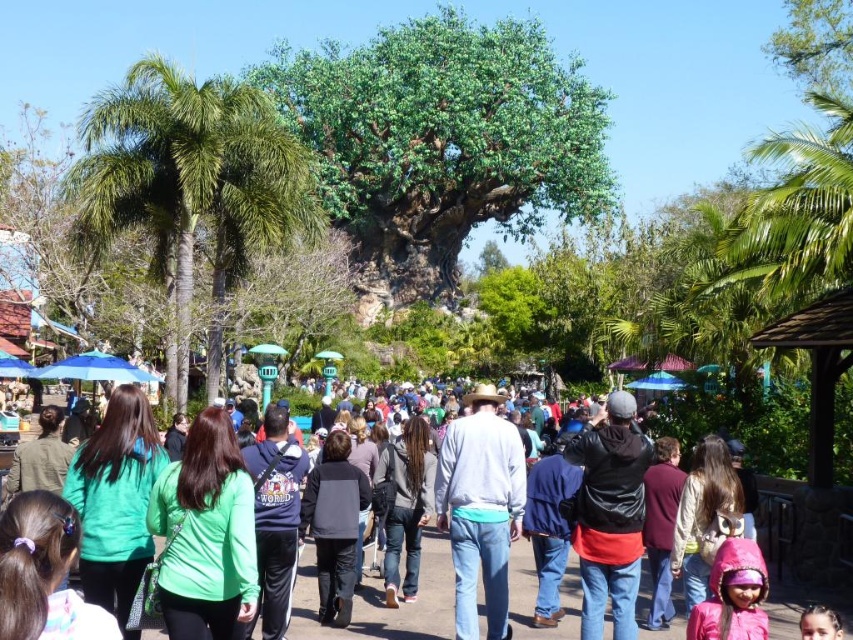
You are standing at the entrance of the theme park and see both the green leafy tree at center and the green casual clothing at center. Which object is closer to you?

The green leafy tree at center is closer to you because the green casual clothing at center is behind it.

You are a photographer positioned at the front of the crowd in the theme park. You want to take a photo of both the black leather jacket at center and the dark gray jacket at center. Which jacket should you adjust your focus to first to ensure both are in the frame?

The black leather jacket at center is closer to the viewer than the dark gray jacket at center, so you should focus on the black leather jacket at center first to ensure both are in the frame.

You are standing in the theme park and want to take a photo of both the large tree and the crowd of people. The large tree is at point (138,552) and the crowd is at point (659,560). Which point should you focus on first to ensure both are in focus?

You should focus on point (138,552) first since it is closer to the viewer than point (659,560), allowing both to be in focus when using depth of field.